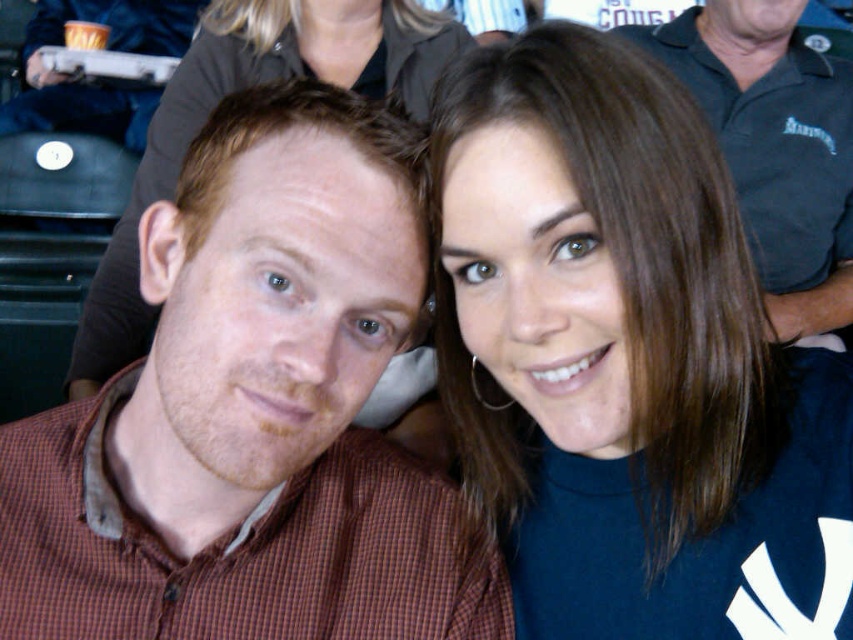
You are a photographer trying to capture a candid shot of two people at a crowded event. The two people are located at point [299,326]. If your camera has a minimum focus distance of 20 inches, will you be able to clearly capture both individuals in focus?

The two people at point [299,326] are 20.81 inches apart. Since the minimum focus distance of your camera is 20 inches, they are just slightly beyond the required distance. Therefore, you might need to adjust your position or use a different lens to ensure both are in focus.

You are standing at the origin point of the image coordinate system. You see two points, point (x=364, y=172) and point (x=79, y=326). Which point is closer to you?

Point (x=364, y=172) is in front of point (x=79, y=326), so it is closer to you.